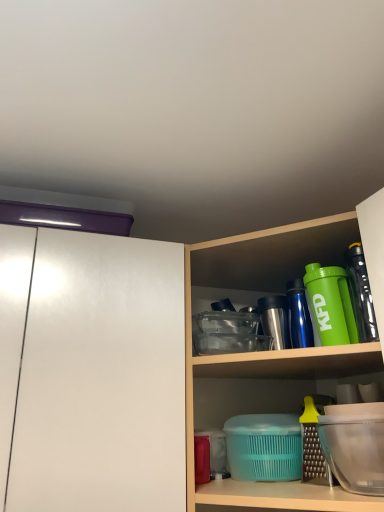
Question: Considering the relative positions of white glossy cabinet at left and transparent plastic container at lower right in the image provided, is white glossy cabinet at left to the right of transparent plastic container at lower right from the viewer's perspective?

Choices:
 (A) no
 (B) yes

Answer: (A)

Question: Considering the relative sizes of white glossy cabinet at left and transparent plastic container at lower right in the image provided, is white glossy cabinet at left thinner than transparent plastic container at lower right?

Choices:
 (A) no
 (B) yes

Answer: (A)

Question: Considering the relative sizes of white glossy cabinet at left and transparent plastic container at lower right in the image provided, is white glossy cabinet at left bigger than transparent plastic container at lower right?

Choices:
 (A) yes
 (B) no

Answer: (A)

Question: Is transparent plastic container at lower right inside white glossy cabinet at left?

Choices:
 (A) no
 (B) yes

Answer: (A)

Question: Does white glossy cabinet at left have a greater height compared to transparent plastic container at lower right?

Choices:
 (A) no
 (B) yes

Answer: (B)

Question: Considering their positions, is white glossy cabinet at left located in front of or behind translucent plastic containers at center?

Choices:
 (A) behind
 (B) front

Answer: (A)

Question: Looking at the image, does white glossy cabinet at left seem bigger or smaller compared to translucent plastic containers at center?

Choices:
 (A) big
 (B) small

Answer: (B)

Question: From their relative heights in the image, would you say white glossy cabinet at left is taller or shorter than translucent plastic containers at center?

Choices:
 (A) tall
 (B) short

Answer: (B)

Question: Choose the correct answer: Is white glossy cabinet at left inside translucent plastic containers at center or outside it?

Choices:
 (A) inside
 (B) outside

Answer: (B)

Question: From the image's perspective, is transparent plastic container at lower right above or below translucent plastic containers at center?

Choices:
 (A) below
 (B) above

Answer: (A)

Question: Would you say transparent plastic container at lower right is inside or outside translucent plastic containers at center?

Choices:
 (A) inside
 (B) outside

Answer: (A)

Question: From a real-world perspective, is transparent plastic container at lower right positioned above or below translucent plastic containers at center?

Choices:
 (A) below
 (B) above

Answer: (A)

Question: In terms of width, does transparent plastic container at lower right look wider or thinner when compared to translucent plastic containers at center?

Choices:
 (A) wide
 (B) thin

Answer: (B)

Question: Is point (79, 429) closer or farther from the camera than point (316, 301)?

Choices:
 (A) closer
 (B) farther

Answer: (A)

Question: From the image's perspective, is white glossy cabinet at left located above or below green matte shaker at upper right, the 2th bottle when ordered from back to front?

Choices:
 (A) above
 (B) below

Answer: (B)